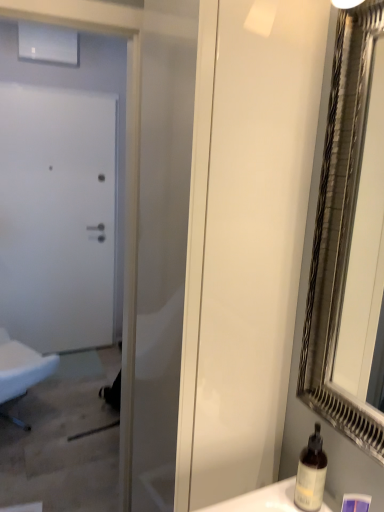
Question: Considering the relative sizes of translucent glass bottle at lower right and white fabric chair at left in the image provided, is translucent glass bottle at lower right bigger than white fabric chair at left?

Choices:
 (A) no
 (B) yes

Answer: (A)

Question: Is translucent glass bottle at lower right not close to white fabric chair at left?

Choices:
 (A) yes
 (B) no

Answer: (A)

Question: Is translucent glass bottle at lower right located outside white fabric chair at left?

Choices:
 (A) no
 (B) yes

Answer: (B)

Question: From a real-world perspective, does translucent glass bottle at lower right stand above white fabric chair at left?

Choices:
 (A) yes
 (B) no

Answer: (A)

Question: Does translucent glass bottle at lower right turn towards white fabric chair at left?

Choices:
 (A) yes
 (B) no

Answer: (B)

Question: From the image's perspective, is white matte door at left positioned above or below white glossy screen door at center?

Choices:
 (A) above
 (B) below

Answer: (A)

Question: Which is correct: white matte door at left is inside white glossy screen door at center, or outside of it?

Choices:
 (A) inside
 (B) outside

Answer: (B)

Question: Is white matte door at left bigger or smaller than white glossy screen door at center?

Choices:
 (A) big
 (B) small

Answer: (B)

Question: From a real-world perspective, is white matte door at left positioned above or below white glossy screen door at center?

Choices:
 (A) below
 (B) above

Answer: (A)

Question: From the image's perspective, is white matte door at left located above or below translucent glass bottle at lower right?

Choices:
 (A) below
 (B) above

Answer: (B)

Question: Is white matte door at left inside or outside of translucent glass bottle at lower right?

Choices:
 (A) inside
 (B) outside

Answer: (B)

Question: From a real-world perspective, is white matte door at left above or below translucent glass bottle at lower right?

Choices:
 (A) above
 (B) below

Answer: (A)

Question: Considering the positions of point (119, 177) and point (301, 449), is point (119, 177) closer or farther from the camera than point (301, 449)?

Choices:
 (A) farther
 (B) closer

Answer: (A)

Question: Considering their positions, is translucent glass bottle at lower right located in front of or behind white fabric chair at left?

Choices:
 (A) front
 (B) behind

Answer: (A)

Question: In terms of width, does translucent glass bottle at lower right look wider or thinner when compared to white fabric chair at left?

Choices:
 (A) thin
 (B) wide

Answer: (A)